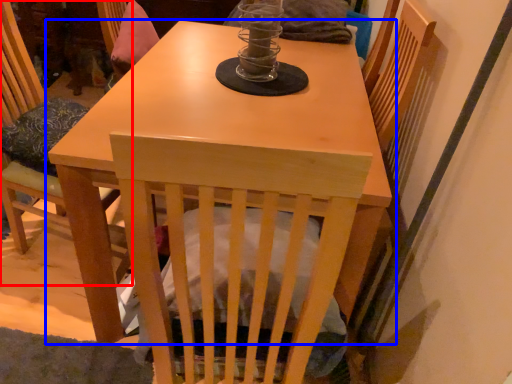
Question: Which of the following is the farthest to the observer, chair (highlighted by a red box) or table (highlighted by a blue box)?

Choices:
 (A) chair
 (B) table

Answer: (A)